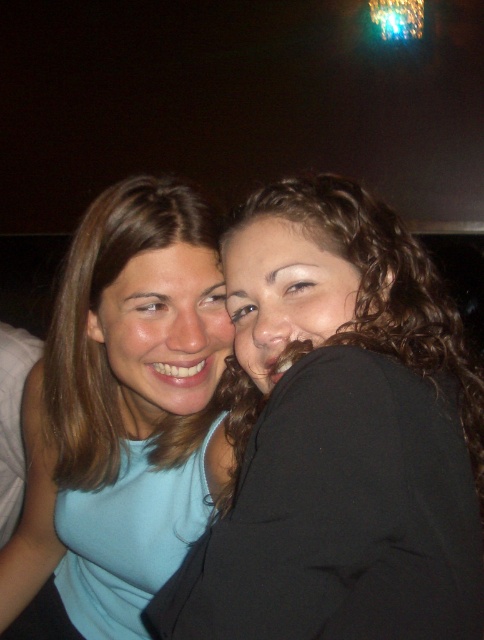
Question: Is matte black jacket at center to the left of light blue fabric at center from the viewer's perspective?

Choices:
 (A) yes
 (B) no

Answer: (B)

Question: Which of the following is the closest to the observer?

Choices:
 (A) light blue fabric at center
 (B) matte black jacket at center

Answer: (B)

Question: Among these objects, which one is nearest to the camera?

Choices:
 (A) matte black jacket at center
 (B) light blue fabric at center

Answer: (A)

Question: Is matte black jacket at center in front of light blue fabric at center?

Choices:
 (A) no
 (B) yes

Answer: (B)

Question: Can you confirm if matte black jacket at center is positioned to the left of light blue fabric at center?

Choices:
 (A) yes
 (B) no

Answer: (B)